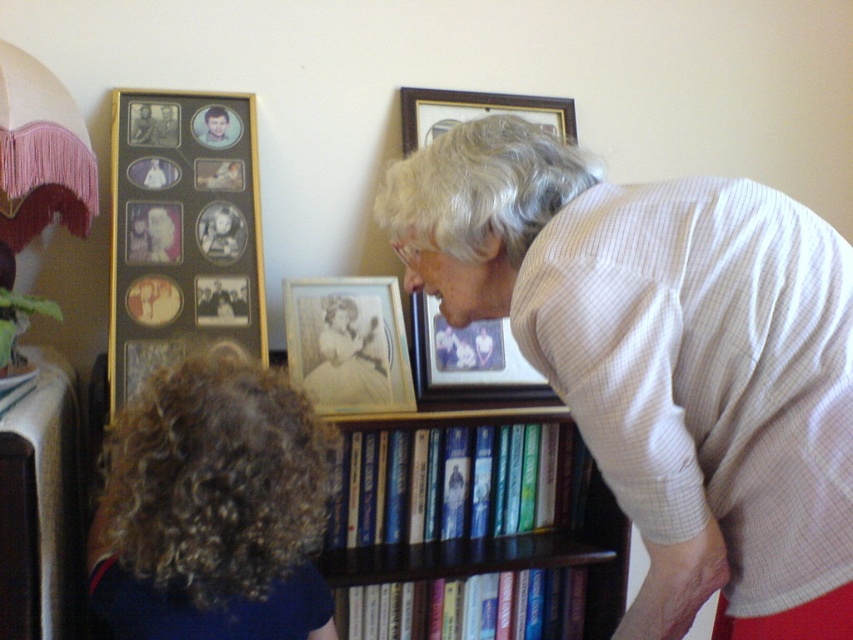
You are a delivery person who needs to place a package between the light beige sweater at center and the bookshelf. The package is 28 inches long. Can you fit it between them?

The distance between the light beige sweater at center and the bookshelf is 30.63 inches. Since the package is 28 inches long, it can fit between them as there is enough space.

You are trying to place a new book on the bookshelf. The new book is the same size as the hardcover book at center. Will the light beige sweater at center currently on the shelf block the placement of the new book?

The light beige sweater at center has a larger width than the hardcover book at center. Since the sweater is wider, it might block the placement of the new book which is the same size as the hardcover book at center.

In the scene shown: You are standing in front of the bookshelf and want to reach the hardcover book at center. If your arm can extend 3.0 feet, can you reach it?

The hardcover book at center is 4.80 feet away from the camera, which is beyond your arm extension of 3.0 feet. You cannot reach it without moving closer or using a tool.